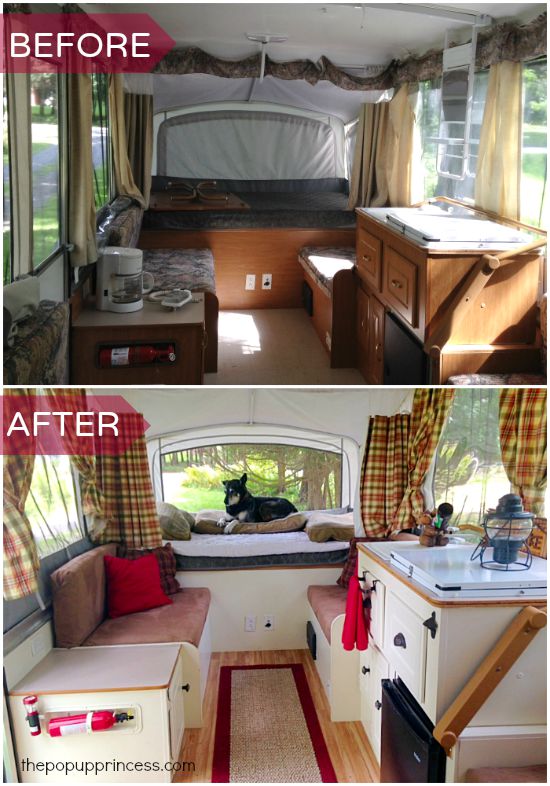
Find the location of `curtains`. curtains is located at coordinates (13, 505).